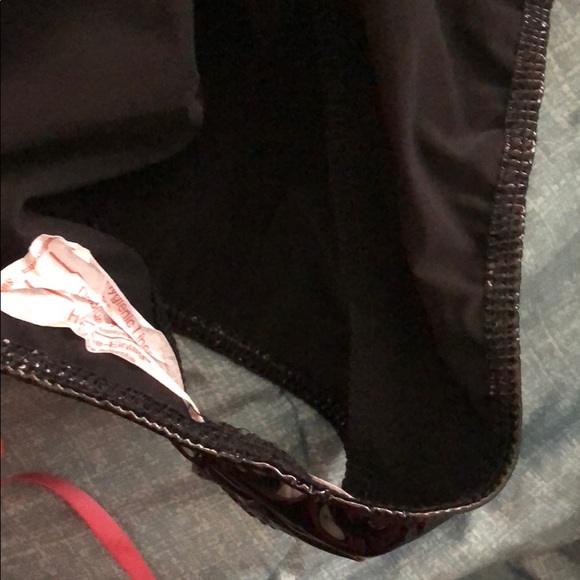
Identify the location of stitch crease in blanket. The height and width of the screenshot is (580, 580). (304, 436).